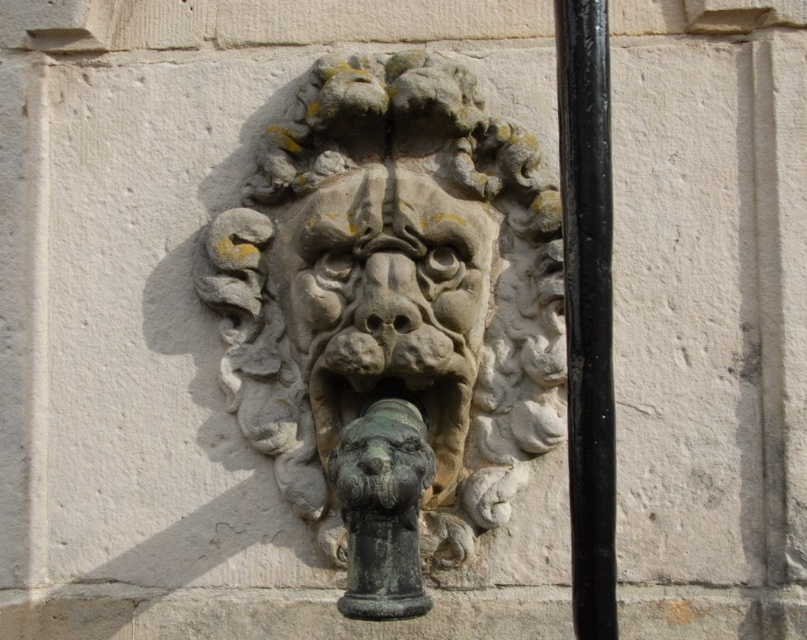
Which of these two, stone textured lion head at center or black metal pole at right, stands taller?

Standing taller between the two is black metal pole at right.

Does stone textured lion head at center appear on the right side of black metal pole at right?

No, stone textured lion head at center is not to the right of black metal pole at right.

Between point (262, 212) and point (590, 141), which one is positioned behind?

The point (262, 212) is more distant.

Where is `stone textured lion head at center`? stone textured lion head at center is located at coordinates (392, 289).

Between point (488, 525) and point (348, 465), which one is positioned behind?

Positioned behind is point (488, 525).

The height and width of the screenshot is (640, 807). In order to click on stone textured lion head at center in this screenshot , I will do `click(392, 289)`.

Which is more to the left, stone textured face at center or bronze statue at center?

Positioned to the left is bronze statue at center.

Between point (328, 364) and point (389, 424), which one is positioned in front?

Point (389, 424) is in front.

Is point (350, 369) positioned before point (391, 596)?

No, it is behind (391, 596).

Identify the location of stone textured face at center. The image size is (807, 640). (391, 282).